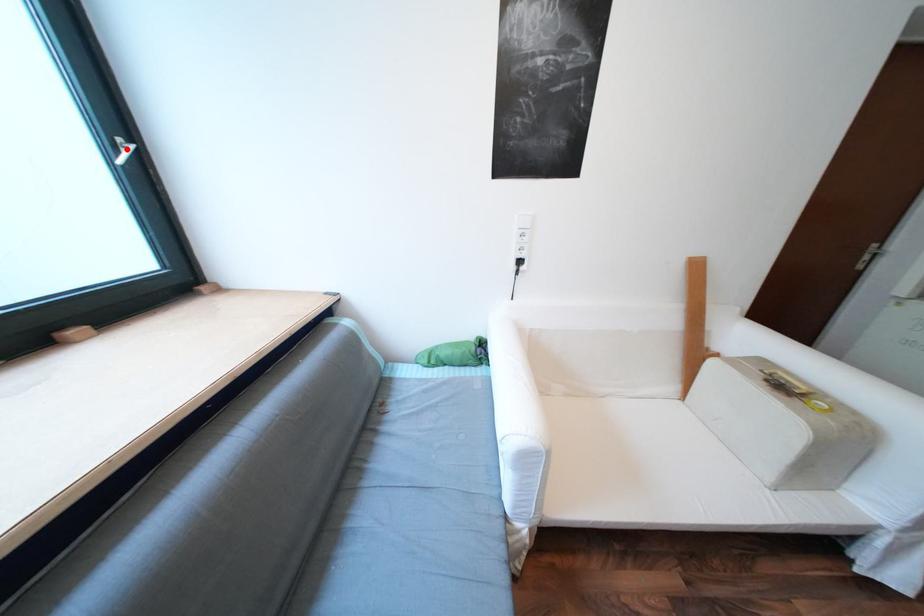
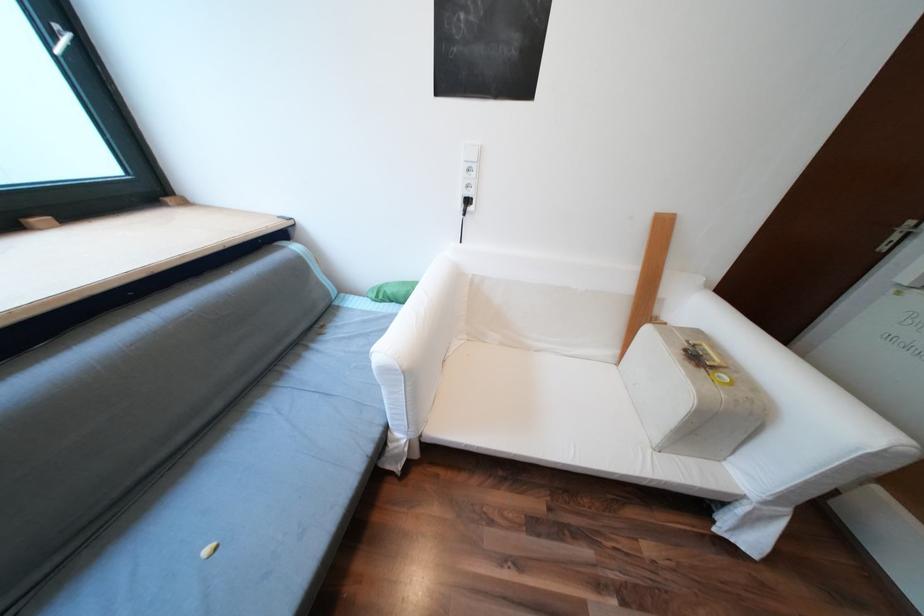
Locate, in the second image, the point that corresponds to the highlighted location in the first image.

(65, 37)